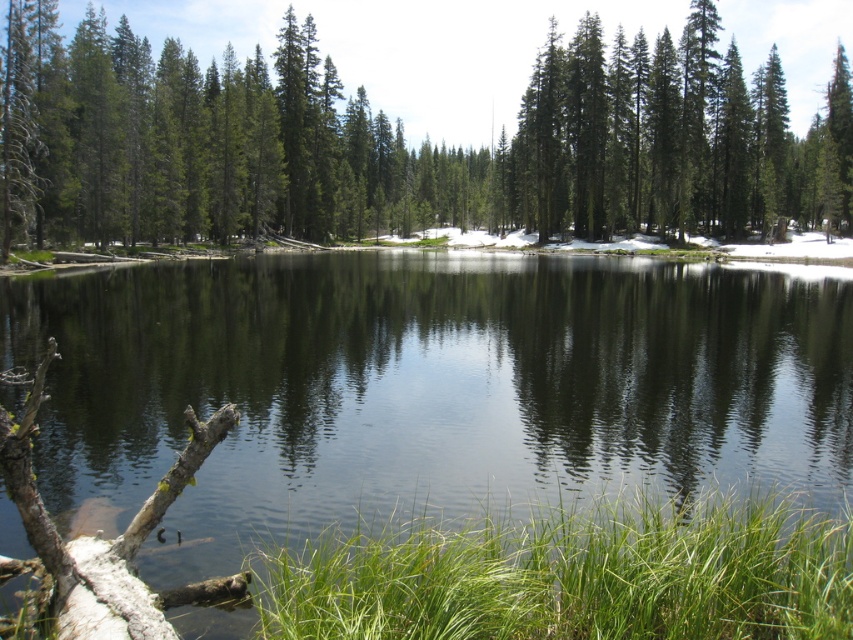
Question: Which point is closer to the camera?

Choices:
 (A) transparent water at center
 (B) green matte tree at center

Answer: (A)

Question: Is transparent water at center smaller than green matte tree at center?

Choices:
 (A) no
 (B) yes

Answer: (B)

Question: Which of the following is the closest to the observer?

Choices:
 (A) (186, 93)
 (B) (809, 282)

Answer: (B)

Question: In this image, where is transparent water at center located relative to green matte tree at center?

Choices:
 (A) right
 (B) left

Answer: (B)

Question: Can you confirm if transparent water at center is smaller than green matte tree at center?

Choices:
 (A) no
 (B) yes

Answer: (B)